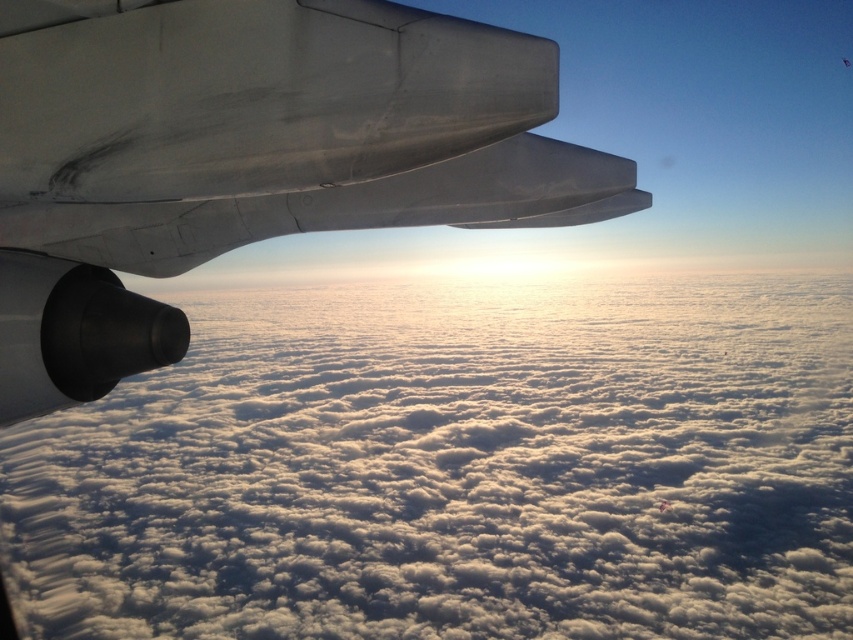
Question: Is white fluffy cloud at upper left further to camera compared to metallic gray wing at upper left?

Choices:
 (A) no
 (B) yes

Answer: (B)

Question: Which of the following is the closest to the observer?

Choices:
 (A) white fluffy cloud at upper left
 (B) metallic gray wing at upper left

Answer: (B)

Question: Is white fluffy cloud at upper left to the left of metallic gray wing at upper left from the viewer's perspective?

Choices:
 (A) no
 (B) yes

Answer: (A)

Question: Does white fluffy cloud at upper left come in front of metallic gray wing at upper left?

Choices:
 (A) yes
 (B) no

Answer: (B)